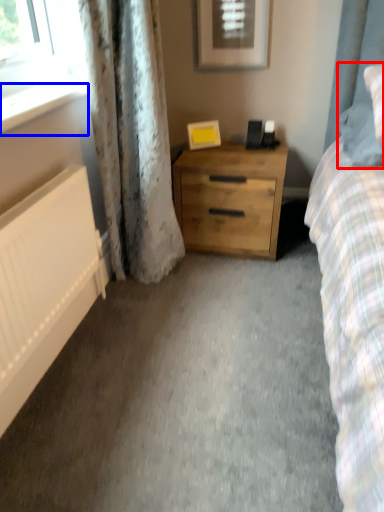
Question: Which point is closer to the camera, pillow (highlighted by a red box) or window sill (highlighted by a blue box)?

Choices:
 (A) pillow
 (B) window sill

Answer: (B)